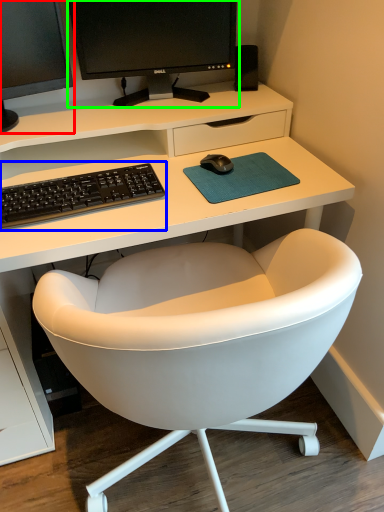
Question: Estimate the real-world distances between objects in this image. Which object is closer to computer monitor (highlighted by a red box), computer keyboard (highlighted by a blue box) or computer monitor (highlighted by a green box)?

Choices:
 (A) computer keyboard
 (B) computer monitor

Answer: (B)